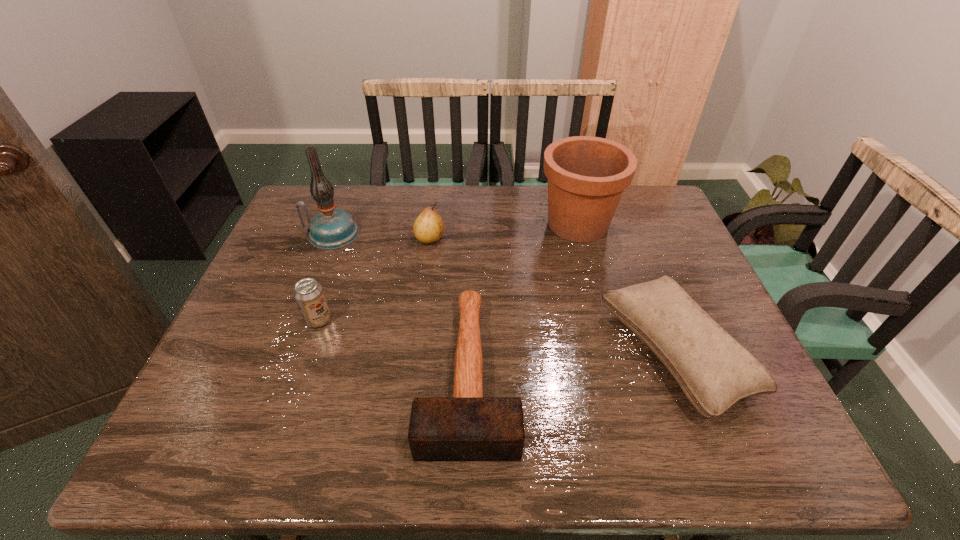
I want to click on free space at the near edge, so click(685, 435).

Find the location of a particular element. The height and width of the screenshot is (540, 960). free space at the left edge of the desktop is located at coordinates (272, 267).

You are a GUI agent. You are given a task and a screenshot of the screen. Output one action in this format:
    pyautogui.click(x=<x>, y=<y>)
    Task: Click on the free space at the right edge
    
    Given the screenshot: What is the action you would take?
    pyautogui.click(x=722, y=417)

The height and width of the screenshot is (540, 960). What are the coordinates of `vacant area at the far left corner` in the screenshot? It's located at (302, 200).

In the image, there is a desktop. Identify the location of vacant space at the near left corner. The image size is (960, 540). (210, 450).

Locate an element on the screen. This screenshot has height=540, width=960. free space at the near right corner of the desktop is located at coordinates (748, 443).

Where is `free point between the mallet and the cushion`? free point between the mallet and the cushion is located at coordinates (571, 363).

Locate an element on the screen. vacant region between the beer can and the shortest object is located at coordinates (394, 346).

Identify the location of vacant area that lies between the tallest object and the cushion. (503, 294).

You are a GUI agent. You are given a task and a screenshot of the screen. Output one action in this format:
    pyautogui.click(x=<x>, y=<y>)
    Task: Click on the free spot between the beer can and the fifth shortest object
    
    Given the screenshot: What is the action you would take?
    pyautogui.click(x=448, y=272)